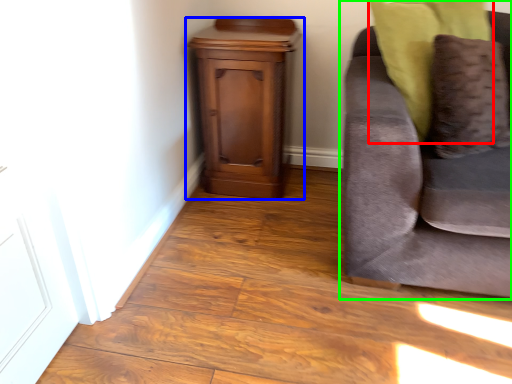
Question: Which object is the closest to the pillow (highlighted by a red box)? Choose among these: nightstand (highlighted by a blue box) or studio couch (highlighted by a green box).

Choices:
 (A) nightstand
 (B) studio couch

Answer: (B)